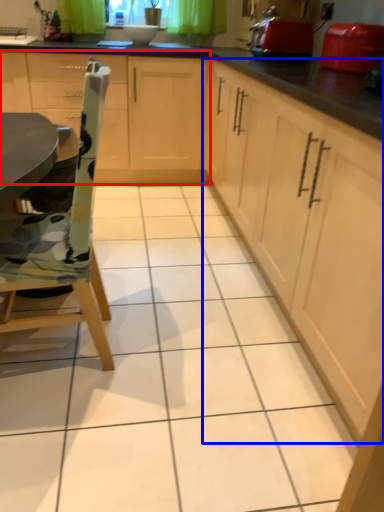
Question: Which of the following is the closest to the observer, cabinetry (highlighted by a red box) or cabinetry (highlighted by a blue box)?

Choices:
 (A) cabinetry
 (B) cabinetry

Answer: (B)